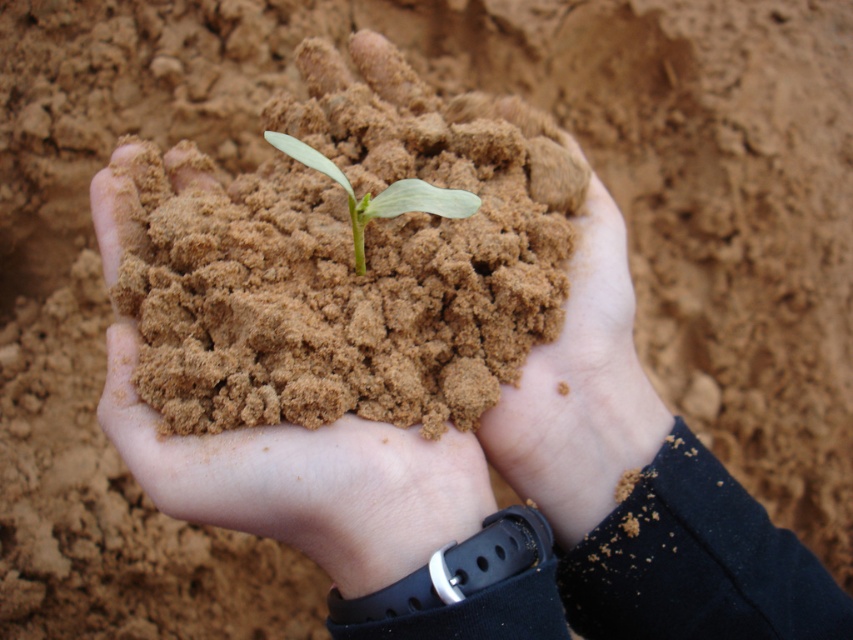
Based on the coordinates provided, is the brown sandy soil at center located at point (350,256)?

Yes, the brown sandy soil at center is located at point (350,256) as stated in the description.

You are a gardener trying to plant a new seedling. You have the brown sandy soil at center and the green matte plant at center in your hands. Considering their widths, which one should you place first into the planting hole to ensure proper growth?

The brown sandy soil at center is wider than the green matte plant at center. Therefore, you should place the green matte plant at center first into the planting hole, ensuring the soil can adequately surround and support it.

You are a gardener holding a small plant in your hands. The plant is surrounded by brown sandy soil at center. You want to place the plant in a pot that is 18 inches wide. Will the plant fit in the pot?

The brown sandy soil at center is 20.27 inches apart, so the pot is not wide enough to accommodate the plant. Please choose a wider pot.